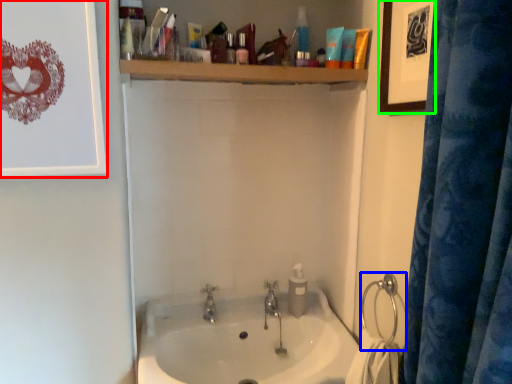
Question: Which object is the closest to the picture frame (highlighted by a red box)? Choose among these: shower (highlighted by a blue box) or picture frame (highlighted by a green box).

Choices:
 (A) shower
 (B) picture frame

Answer: (B)